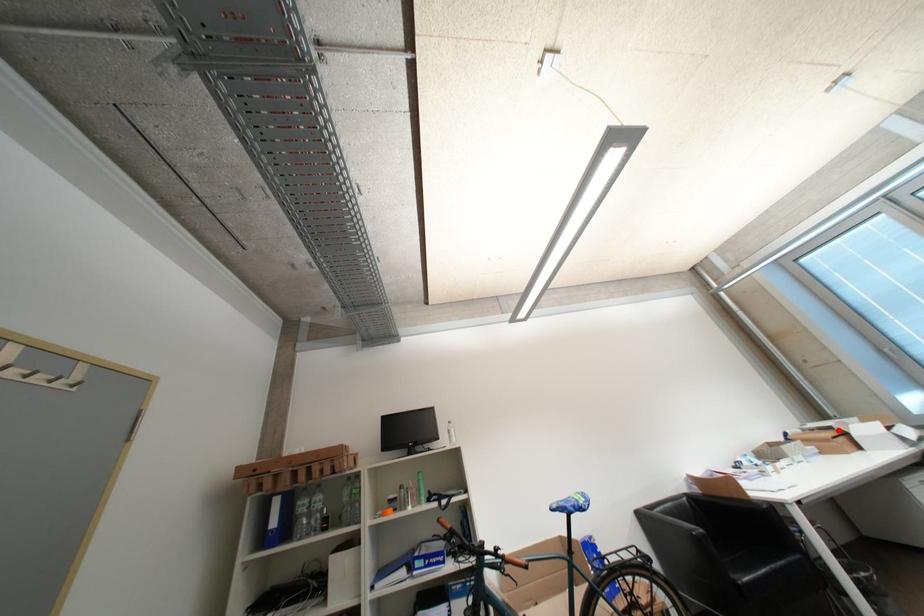
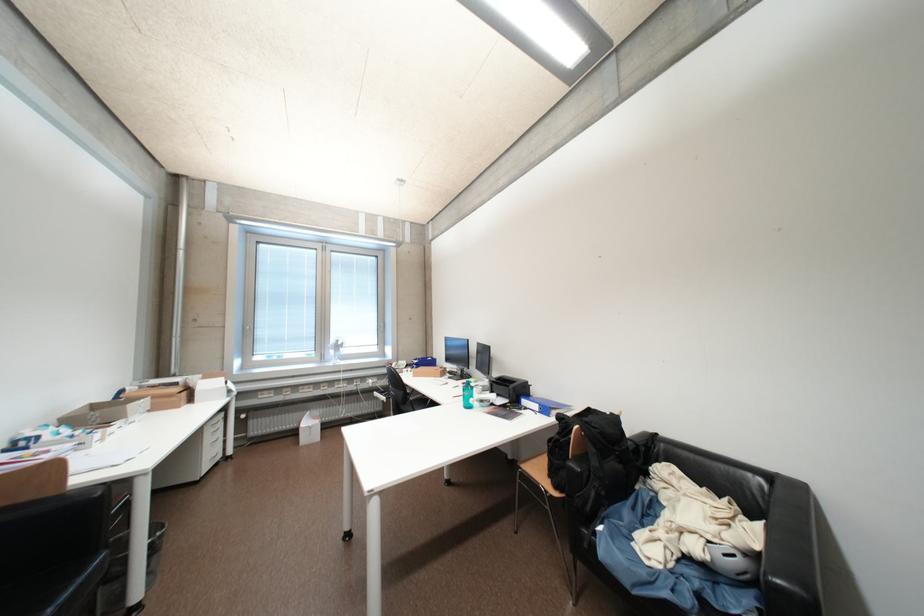
Locate, in the second image, the point that corresponds to the highlighted location in the first image.

(184, 386)